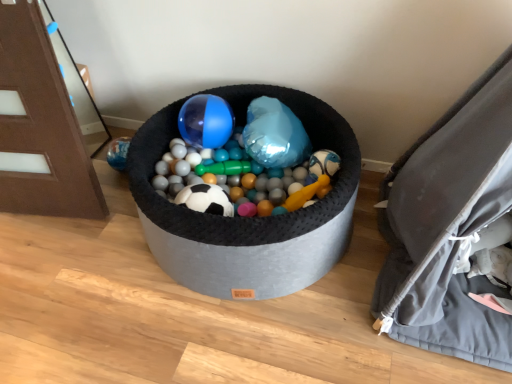
Measure the distance between point [90,114] and camera.

They are 8.08 feet apart.

Identify the location of translucent plastic ball at center. (247, 218).

This screenshot has height=384, width=512. Find the location of `toy located on the left of gray fabric bean bag chair at right`. toy located on the left of gray fabric bean bag chair at right is located at coordinates (247, 218).

From a real-world perspective, between translucent plastic ball at center and gray fabric bean bag chair at right, who is vertically lower?

translucent plastic ball at center, from a real-world perspective.

Does translucent plastic ball at center have a greater width compared to gray fabric bean bag chair at right?

No, translucent plastic ball at center is not wider than gray fabric bean bag chair at right.

Is the depth of translucent plastic ball at center less than that of gray fabric bean bag chair at right?

No, translucent plastic ball at center is behind gray fabric bean bag chair at right.

From the image's perspective, which one is positioned lower, gray fabric bean bag chair at right or translucent plastic ball at center?

translucent plastic ball at center, from the image's perspective.

Could you tell me if gray fabric bean bag chair at right is turned towards translucent plastic ball at center?

No, gray fabric bean bag chair at right is not facing towards translucent plastic ball at center.

At what (x,y) coordinates should I click in order to perform the action: click on bean bag chair above the translucent plastic ball at center (from the image's perspective). Please return your answer as a coordinate pair (x, y). This screenshot has width=512, height=384. Looking at the image, I should click on (449, 225).

Does point (450, 290) come behind point (137, 135)?

No, (450, 290) is in front of (137, 135).

Considering the relative positions of translucent plastic ball at center and brushed wood door at left in the image provided, is translucent plastic ball at center behind brushed wood door at left?

Yes, it is behind brushed wood door at left.

How many degrees apart are the facing directions of translucent plastic ball at center and brushed wood door at left?

5.98 degrees separate the facing orientations of translucent plastic ball at center and brushed wood door at left.

Is translucent plastic ball at center to the left of brushed wood door at left from the viewer's perspective?

No, translucent plastic ball at center is not to the left of brushed wood door at left.

Is translucent plastic ball at center looking in the opposite direction of brushed wood door at left?

No, brushed wood door at left is not at the back of translucent plastic ball at center.

Considering the relative sizes of brushed wood door at left and gray fabric bean bag chair at right in the image provided, is brushed wood door at left smaller than gray fabric bean bag chair at right?

Yes, brushed wood door at left is smaller than gray fabric bean bag chair at right.

Can we say brushed wood door at left lies outside gray fabric bean bag chair at right?

Yes, brushed wood door at left is located beyond the bounds of gray fabric bean bag chair at right.

From a real-world perspective, is brushed wood door at left positioned over gray fabric bean bag chair at right based on gravity?

Indeed, from a real-world perspective, brushed wood door at left stands above gray fabric bean bag chair at right.

In the image, is brushed wood door at left positioned in front of or behind gray fabric bean bag chair at right?

Visually, brushed wood door at left is located behind gray fabric bean bag chair at right.

Which object is wider, gray fabric bean bag chair at right or brushed wood door at left?

gray fabric bean bag chair at right is wider.

Is gray fabric bean bag chair at right not close to brushed wood door at left?

gray fabric bean bag chair at right is far away from brushed wood door at left.

Where is `furniture behind the gray fabric bean bag chair at right`? furniture behind the gray fabric bean bag chair at right is located at coordinates (45, 120).

From the image's perspective, is brushed wood door at left located above translucent plastic ball at center?

Yes, from the image's perspective, brushed wood door at left is on top of translucent plastic ball at center.

Between brushed wood door at left and translucent plastic ball at center, which one has smaller width?

brushed wood door at left is thinner.

Based on the photo, how different are the orientations of brushed wood door at left and translucent plastic ball at center in degrees?

The facing directions of brushed wood door at left and translucent plastic ball at center are 5.98 degrees apart.

Identify the location of toy below the gray fabric bean bag chair at right (from the image's perspective). The width and height of the screenshot is (512, 384). (247, 218).

The width and height of the screenshot is (512, 384). I want to click on toy on the left of the gray fabric bean bag chair at right, so click(x=247, y=218).

Based on their spatial positions, is translucent plastic ball at center or gray fabric bean bag chair at right further from brushed wood door at left?

gray fabric bean bag chair at right is positioned further to the anchor brushed wood door at left.

When comparing their distances from gray fabric bean bag chair at right, does translucent plastic ball at center or brushed wood door at left seem closer?

translucent plastic ball at center lies closer to gray fabric bean bag chair at right than the other object.

Looking at the image, which one is located closer to gray fabric bean bag chair at right, brushed wood door at left or translucent plastic ball at center?

translucent plastic ball at center.

Estimate the real-world distances between objects in this image. Which object is further from brushed wood door at left, gray fabric bean bag chair at right or translucent plastic ball at center?

gray fabric bean bag chair at right.

Which object lies further to the anchor point translucent plastic ball at center, brushed wood door at left or gray fabric bean bag chair at right?

brushed wood door at left is positioned further to the anchor translucent plastic ball at center.

From the image, which object appears to be nearer to translucent plastic ball at center, gray fabric bean bag chair at right or brushed wood door at left?

Among the two, gray fabric bean bag chair at right is located nearer to translucent plastic ball at center.

Identify the location of toy located between brushed wood door at left and gray fabric bean bag chair at right in the left-right direction. (247, 218).